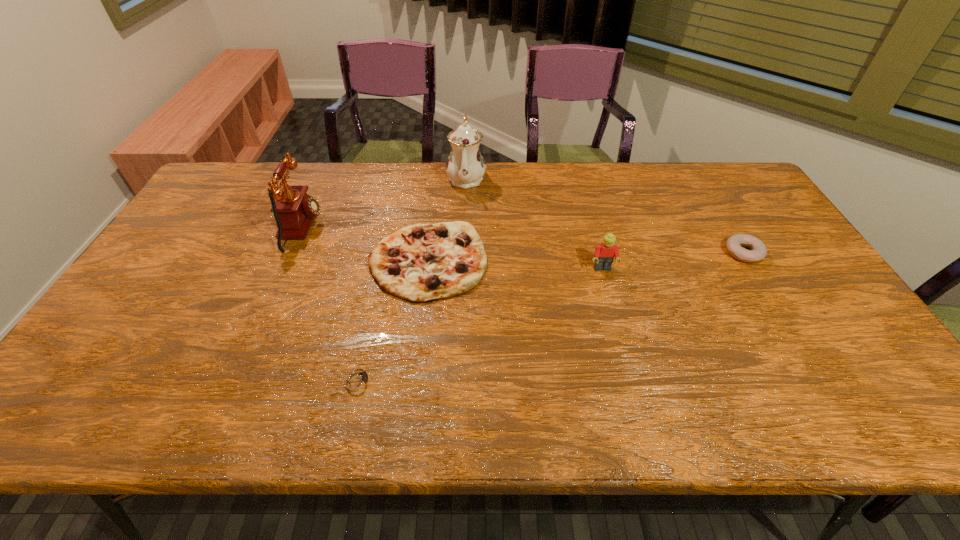
The height and width of the screenshot is (540, 960). What are the coordinates of `vacant space at the right edge of the desktop` in the screenshot? It's located at (741, 202).

I want to click on blank space at the far left corner, so click(223, 198).

Where is `free space between the Lego and the rightmost object`? Image resolution: width=960 pixels, height=540 pixels. free space between the Lego and the rightmost object is located at coordinates (673, 261).

Where is `free space between the pizza and the farthest object`? The image size is (960, 540). free space between the pizza and the farthest object is located at coordinates (447, 220).

Where is `blank region between the shortest object and the Lego`? The height and width of the screenshot is (540, 960). blank region between the shortest object and the Lego is located at coordinates (480, 324).

Locate an element on the screen. empty space that is in between the fifth object from left to right and the pizza is located at coordinates click(516, 265).

Find the location of `vacant area that lies between the pizza and the farthest object`. vacant area that lies between the pizza and the farthest object is located at coordinates (447, 220).

Where is `unoccupied area between the rightmost object and the chinaware`? unoccupied area between the rightmost object and the chinaware is located at coordinates point(605,215).

Locate an element on the screen. vacant area that lies between the doughnut and the pizza is located at coordinates (586, 257).

At what (x,y) coordinates should I click in order to perform the action: click on vacant space that is in between the farthest object and the rightmost object. Please return your answer as a coordinate pair (x, y). The image size is (960, 540). Looking at the image, I should click on (605, 215).